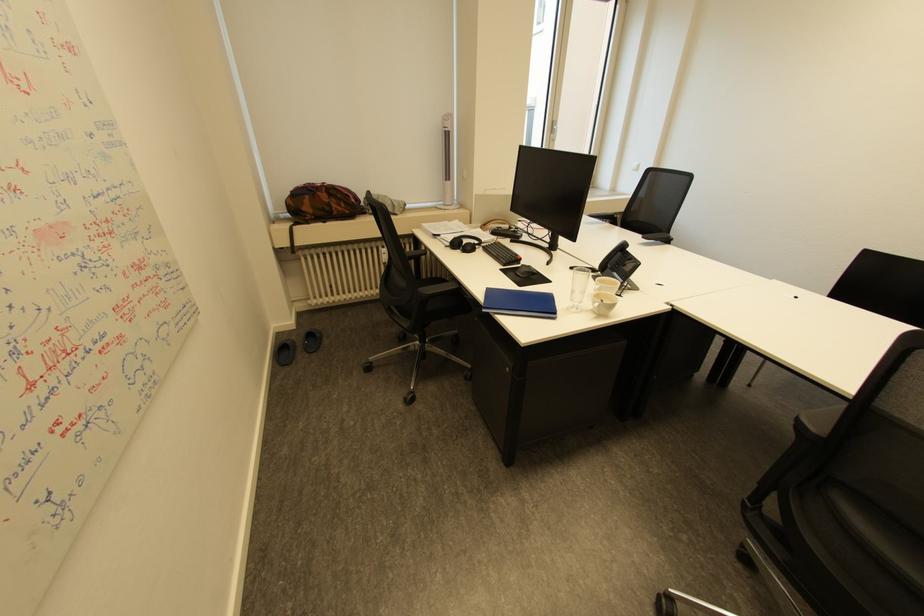
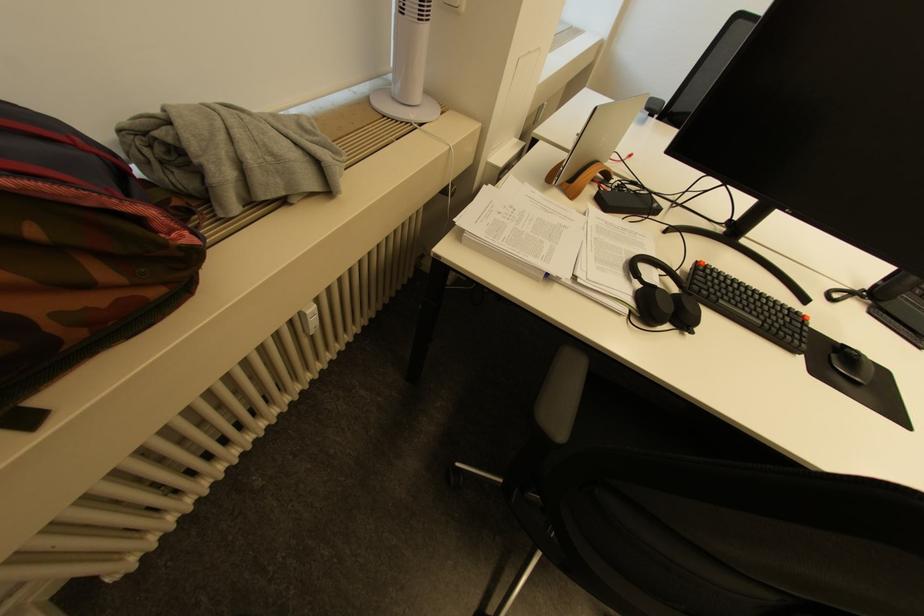
In the second image, find the point that corresponds to (511,265) in the first image.

(800, 351)